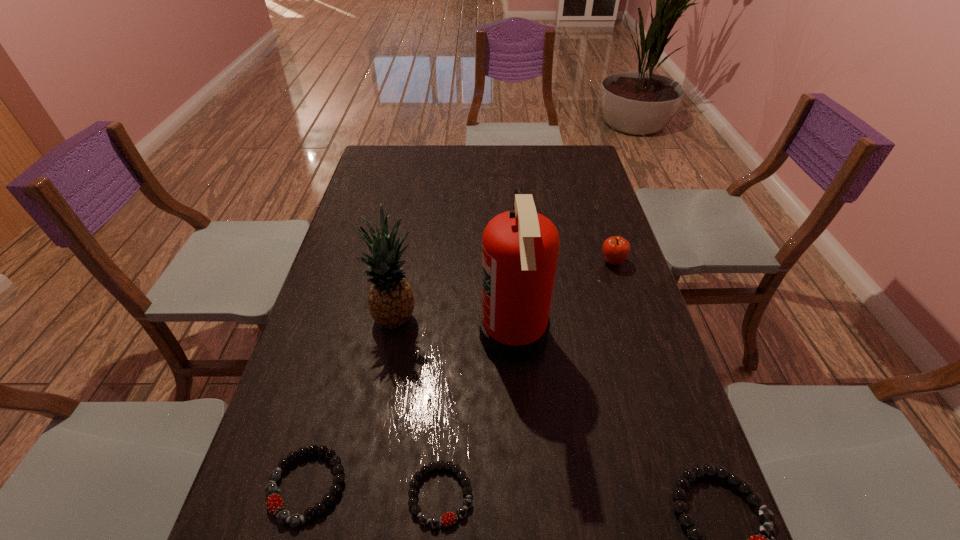
To make them evenly spaced by inserting another bracelet among them, please locate a vacant spot for this new bracelet. Please provide its 2D coordinates. Your answer should be formatted as a tuple, i.e. [(x, y)], where the tuple contains the x and y coordinates of a point satisfying the conditions above.

[(579, 504)]